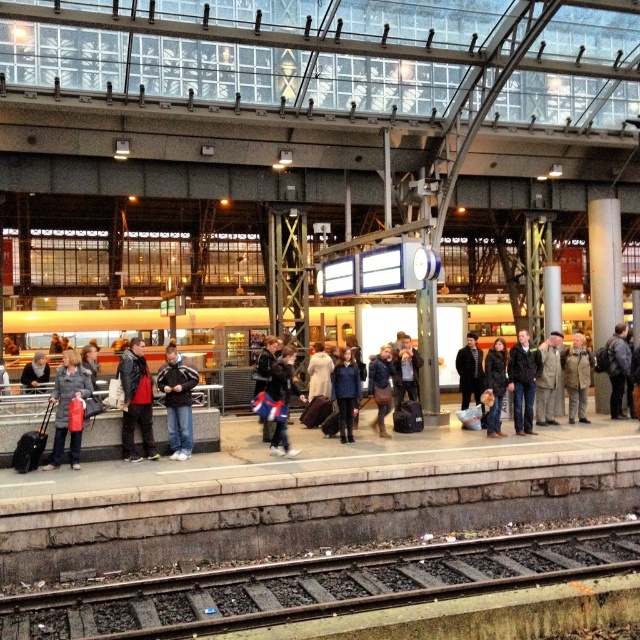
Question: Which point appears closest to the camera in this image?

Choices:
 (A) (81, 381)
 (B) (364, 609)
 (C) (557, 376)

Answer: (B)

Question: Which of the following is the closest to the observer?

Choices:
 (A) matte black jacket at center
 (B) leather jacket at center
 (C) metallic silver train at center

Answer: (A)

Question: Does leather jacket at center appear over dark blue jeans at center?

Choices:
 (A) yes
 (B) no

Answer: (B)

Question: Does dark blue jeans at center have a lesser width compared to matte black jacket at center?

Choices:
 (A) no
 (B) yes

Answer: (A)

Question: Which object is the closest to the metallic silver train at center?

Choices:
 (A) khaki wool coat at center
 (B) matte black jacket at center
 (C) dark blue jeans at center

Answer: (A)

Question: Is dark gray metal train track at lower center smaller than khaki wool coat at center?

Choices:
 (A) yes
 (B) no

Answer: (A)